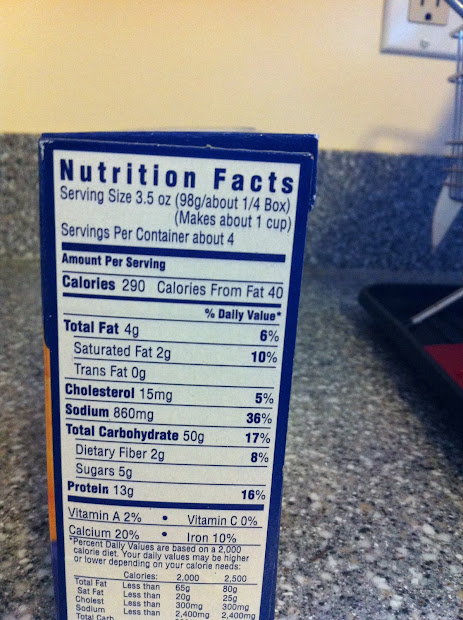
Identify the location of yellow wall. Image resolution: width=463 pixels, height=620 pixels. (203, 66).